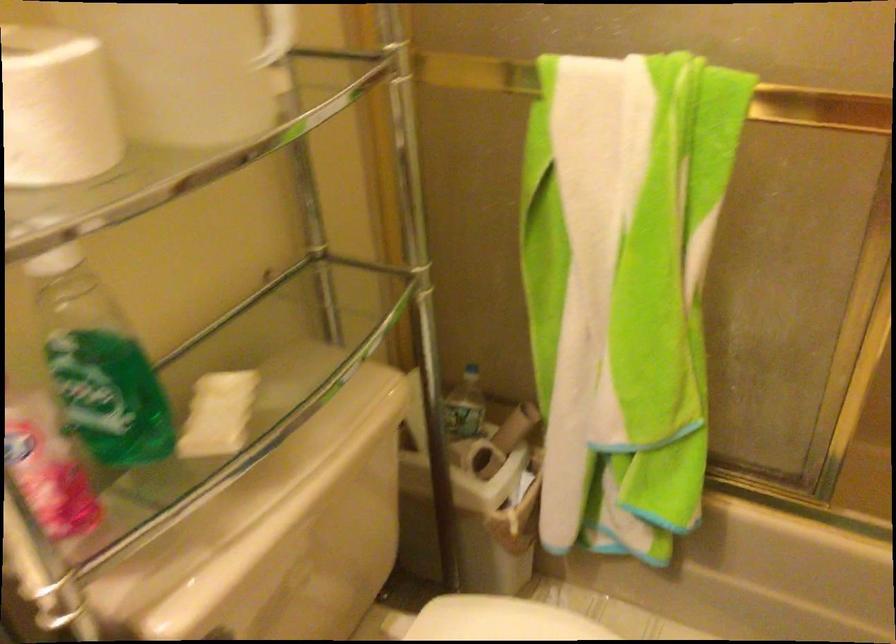
Find where to lift the white toilet seat. Please return your answer as a coordinate pair (x, y).

(500, 620)